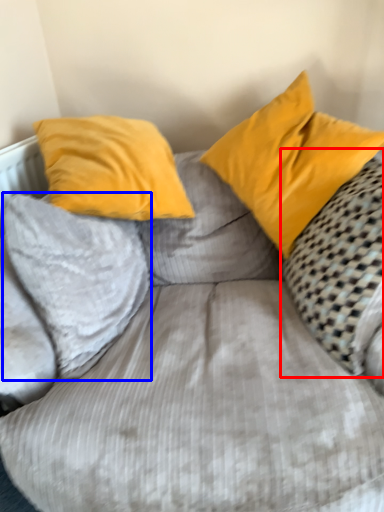
Question: Which of the following is the closest to the observer, pillow (highlighted by a red box) or pillow (highlighted by a blue box)?

Choices:
 (A) pillow
 (B) pillow

Answer: (A)